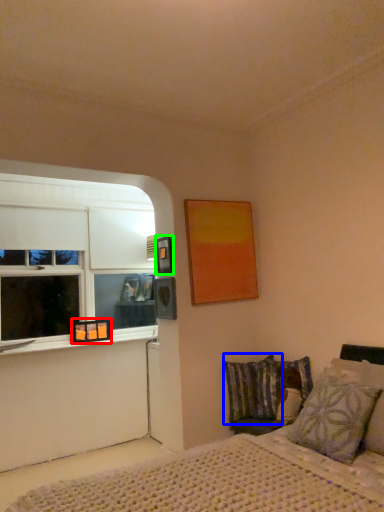
Question: Which is farther away from picture frame (highlighted by a red box)? pillow (highlighted by a blue box) or picture frame (highlighted by a green box)?

Choices:
 (A) pillow
 (B) picture frame

Answer: (A)